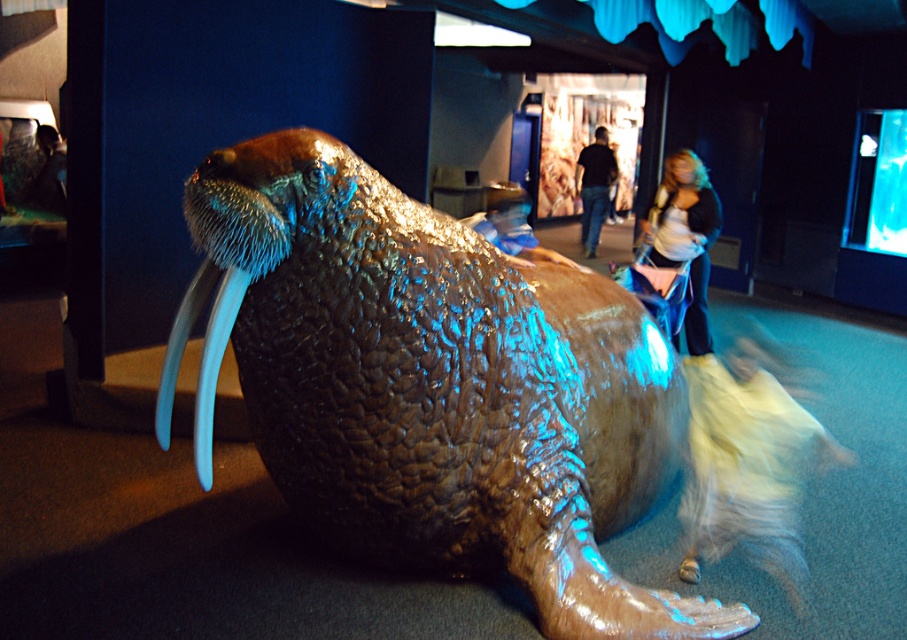
Between point (681, 240) and point (202, 467), which one is positioned in front?

Positioned in front is point (202, 467).

Is blonde hair at upper right bigger than blue plastic tusk at lower left?

Indeed, blonde hair at upper right has a larger size compared to blue plastic tusk at lower left.

Where is `blonde hair at upper right`? blonde hair at upper right is located at coordinates (685, 237).

Does blue plastic tusk at lower left have a greater height compared to dark blue jeans at center?

Incorrect, blue plastic tusk at lower left's height is not larger of dark blue jeans at center's.

Can you confirm if blue plastic tusk at lower left is positioned below dark blue jeans at center?

Yes, blue plastic tusk at lower left is below dark blue jeans at center.

Locate an element on the screen. blue plastic tusk at lower left is located at coordinates (213, 365).

Can you confirm if shiny brown walrus at center is smaller than blue plastic tusk at lower left?

Incorrect, shiny brown walrus at center is not smaller in size than blue plastic tusk at lower left.

This screenshot has width=907, height=640. What do you see at coordinates (417, 388) in the screenshot?
I see `shiny brown walrus at center` at bounding box center [417, 388].

This screenshot has width=907, height=640. Describe the element at coordinates (417, 388) in the screenshot. I see `shiny brown walrus at center` at that location.

Identify the location of shiny brown walrus at center. (417, 388).